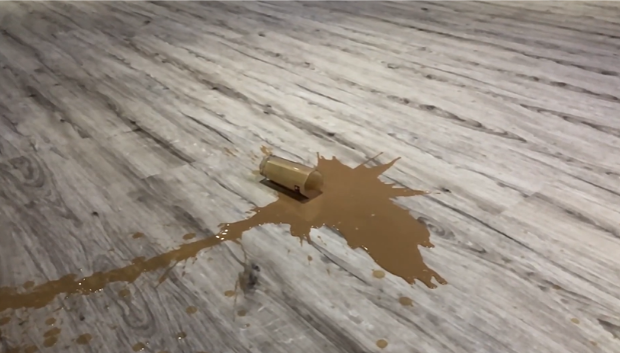
Find the location of `grain in wood floor`. grain in wood floor is located at coordinates (441, 107), (570, 117), (573, 90), (288, 116).